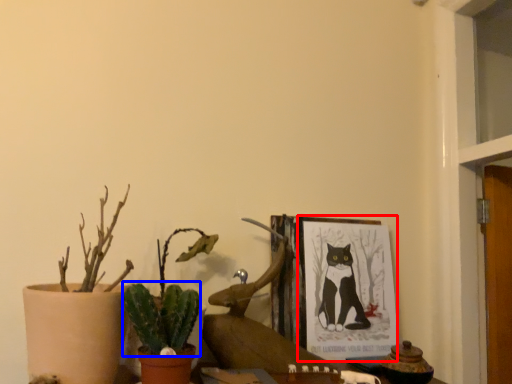
Question: Which object is closer to the camera taking this photo, picture frame (highlighted by a red box) or plant (highlighted by a blue box)?

Choices:
 (A) picture frame
 (B) plant

Answer: (B)